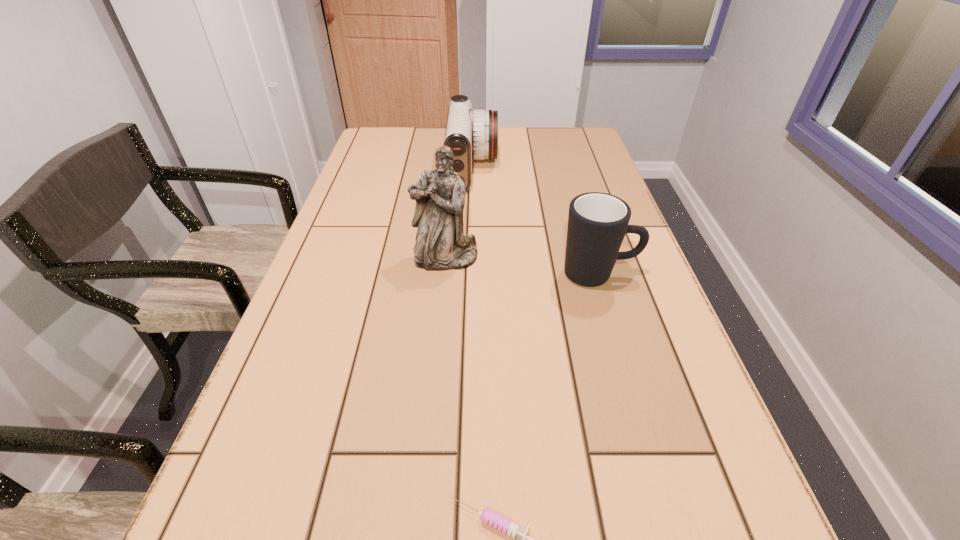
The width and height of the screenshot is (960, 540). I want to click on free region at the far right corner of the desktop, so click(x=552, y=141).

You are a GUI agent. You are given a task and a screenshot of the screen. Output one action in this format:
    pyautogui.click(x=<x>, y=<y>)
    Task: Click on the free spot between the mug and the farthest object
    
    Given the screenshot: What is the action you would take?
    pyautogui.click(x=536, y=222)

Locate an element on the screen. vacant space in between the mug and the farthest object is located at coordinates (536, 222).

Where is `vacant point located between the figurine and the mug`? The height and width of the screenshot is (540, 960). vacant point located between the figurine and the mug is located at coordinates (522, 266).

Locate an element on the screen. Image resolution: width=960 pixels, height=540 pixels. object that stands as the second closest to the mug is located at coordinates (470, 134).

Locate an element on the screen. Image resolution: width=960 pixels, height=540 pixels. object that is the third closest one to the tallest object is located at coordinates (506, 526).

The image size is (960, 540). What are the coordinates of `vacant region that satisfies the following two spatial constraints: 1. on the surface of the farthest object; 2. on the front-facing side of the figurine` in the screenshot? It's located at [470, 258].

In order to click on free space that satisfies the following two spatial constraints: 1. on the surface of the farthest object; 2. on the front-facing side of the figurine in this screenshot , I will do `click(470, 258)`.

This screenshot has height=540, width=960. I want to click on free spot that satisfies the following two spatial constraints: 1. on the surface of the camcorder; 2. on the front-facing side of the tallest object, so click(x=470, y=258).

The image size is (960, 540). Identify the location of free space in the image that satisfies the following two spatial constraints: 1. on the surface of the camcorder; 2. on the front-facing side of the figurine. (470, 258).